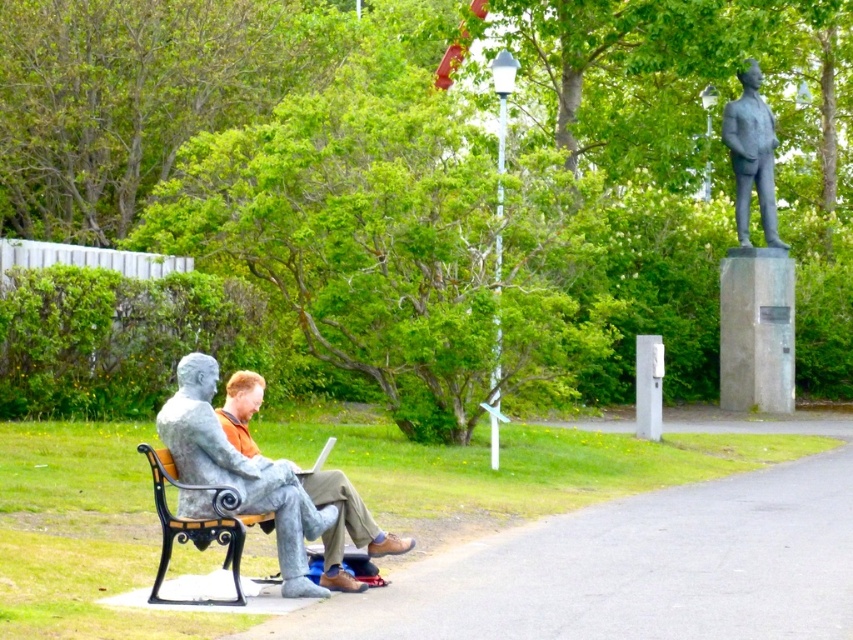
Is point (202, 520) positioned after point (746, 164)?

That is False.

How much distance is there between black wrought iron bench at left and polished bronze statue at upper right?

black wrought iron bench at left and polished bronze statue at upper right are 67.85 feet apart.

Between point (201, 545) and point (738, 161), which one is positioned behind?

Point (738, 161)

Image resolution: width=853 pixels, height=640 pixels. What are the coordinates of `black wrought iron bench at left` in the screenshot? It's located at (196, 525).

Who is lower down, gray stone statue at center or black wrought iron bench at left?

gray stone statue at center

Does gray stone statue at center have a greater height compared to black wrought iron bench at left?

Incorrect, gray stone statue at center's height is not larger of black wrought iron bench at left's.

Who is more distant from viewer, (399, 548) or (225, 557)?

Point (399, 548)

At what (x,y) coordinates should I click in order to perform the action: click on gray stone statue at center. Please return your answer as a coordinate pair (x, y). This screenshot has width=853, height=640. Looking at the image, I should click on (347, 529).

Can you confirm if smooth stone bench at lower left is positioned below gray stone statue at center?

Indeed, smooth stone bench at lower left is positioned under gray stone statue at center.

Is point (660, 564) closer to camera compared to point (250, 410)?

That is False.

Locate an element on the screen. The height and width of the screenshot is (640, 853). smooth stone bench at lower left is located at coordinates (633, 566).

The height and width of the screenshot is (640, 853). In order to click on smooth stone bench at lower left in this screenshot , I will do `click(633, 566)`.